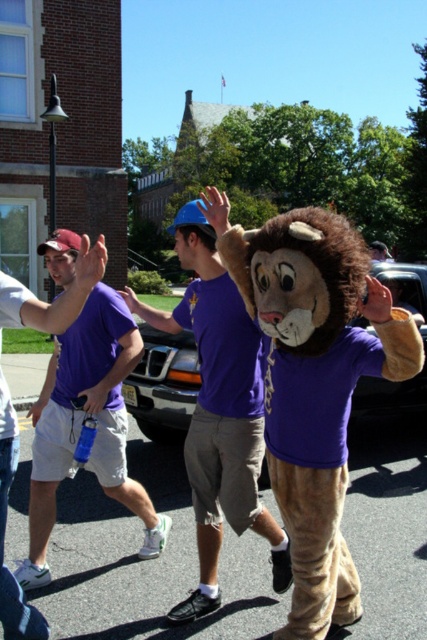
Does purple cotton t-shirt at center have a lesser width compared to matte purple t-shirt at center?

In fact, purple cotton t-shirt at center might be wider than matte purple t-shirt at center.

Does purple cotton t-shirt at center lie in front of matte purple t-shirt at center?

That is True.

Which is in front, point (215, 440) or point (125, 420)?

Positioned in front is point (215, 440).

This screenshot has height=640, width=427. I want to click on purple cotton t-shirt at center, so click(219, 403).

Can you confirm if fuzzy brown costume at center is taller than purple cotton t-shirt at center?

No, fuzzy brown costume at center is not taller than purple cotton t-shirt at center.

What do you see at coordinates (148, 563) in the screenshot?
I see `fuzzy brown costume at center` at bounding box center [148, 563].

In order to click on fuzzy brown costume at center in this screenshot , I will do `click(148, 563)`.

You are a GUI agent. You are given a task and a screenshot of the screen. Output one action in this format:
    pyautogui.click(x=<x>, y=<y>)
    Task: Click on the fuzzy brown costume at center
    The image size is (427, 640).
    Given the screenshot: What is the action you would take?
    pyautogui.click(x=148, y=563)

Is point (108, 520) more distant than point (43, 529)?

Yes, it is.

Does point (394, 566) lie behind point (84, 323)?

That is True.

Find the location of `fuzzy brown costume at center`. fuzzy brown costume at center is located at coordinates (148, 563).